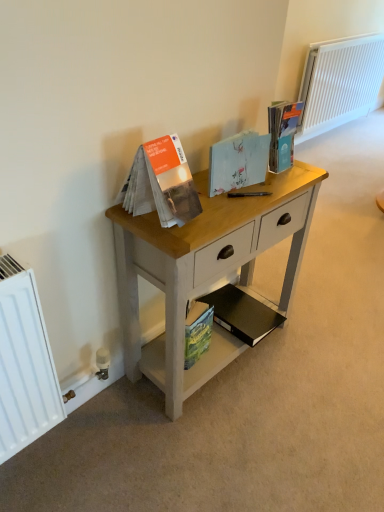
Locate an element on the screen. The width and height of the screenshot is (384, 512). free spot to the right of light wood desk at center is located at coordinates (321, 356).